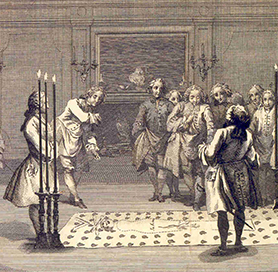
Identify the location of 3 areas of candles. This screenshot has width=278, height=272. (204, 65), (85, 62), (50, 183).